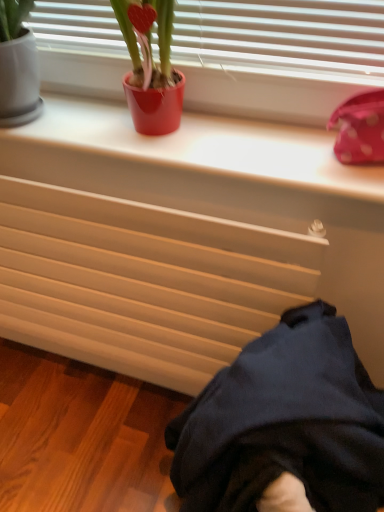
Find the location of a particular element. The image size is (384, 512). vacant space in front of shiny red pot at upper center is located at coordinates (163, 152).